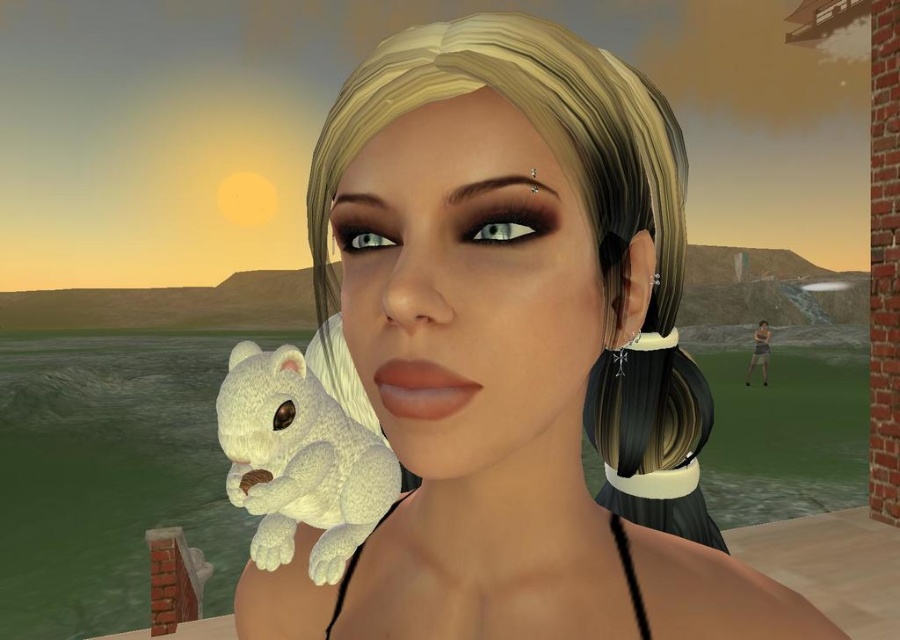
Question: Which object is farther from the camera taking this photo?

Choices:
 (A) white plush bear at center
 (B) white plush toy at center

Answer: (B)

Question: Among these objects, which one is nearest to the camera?

Choices:
 (A) white plush bear at center
 (B) white plush toy at center

Answer: (A)

Question: Can you confirm if white plush bear at center is positioned above white plush toy at center?

Choices:
 (A) yes
 (B) no

Answer: (A)

Question: Is white plush bear at center in front of white plush toy at center?

Choices:
 (A) yes
 (B) no

Answer: (A)

Question: From the image, what is the correct spatial relationship of white plush bear at center in relation to white plush toy at center?

Choices:
 (A) below
 (B) above

Answer: (B)

Question: Which point is closer to the camera taking this photo?

Choices:
 (A) [451, 376]
 (B) [371, 499]

Answer: (A)